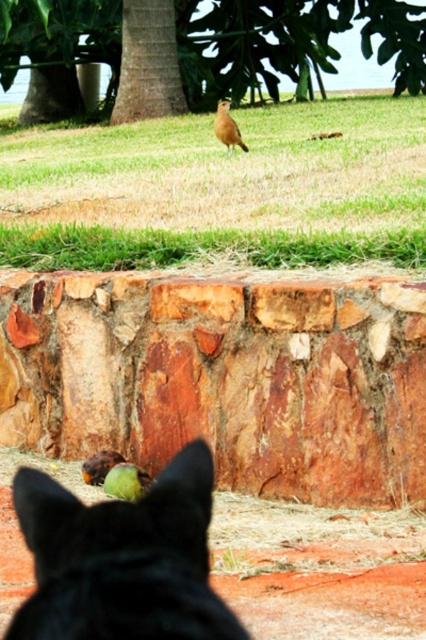
You are a gardener planning to plant flowers in the green grass at center and under the green leafy tree at upper center. Which area has more space for planting based on their widths?

The green leafy tree at upper center has a wider area than the green grass at center, so it offers more space for planting flowers.